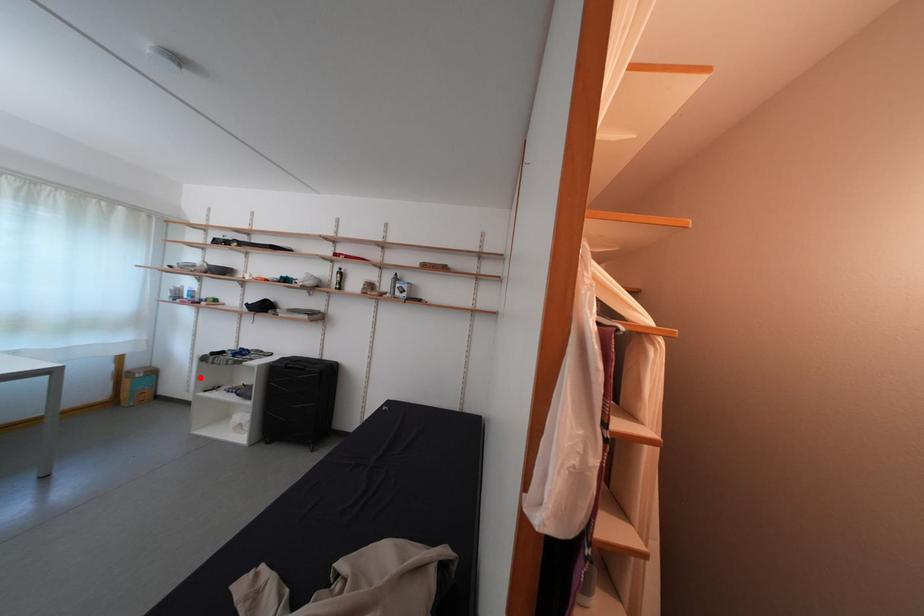
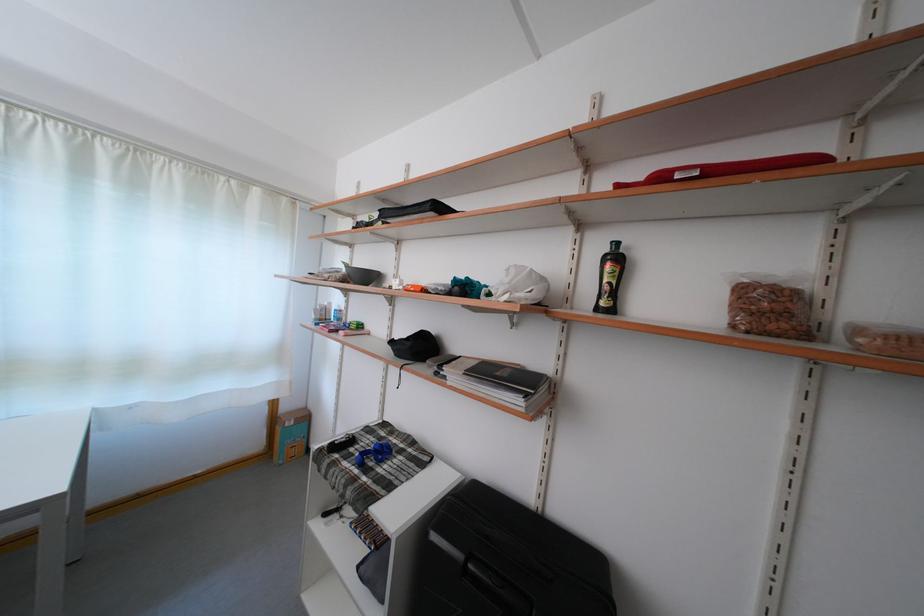
The point at the highlighted location is marked in the first image. Where is the corresponding point in the second image?

(344, 436)